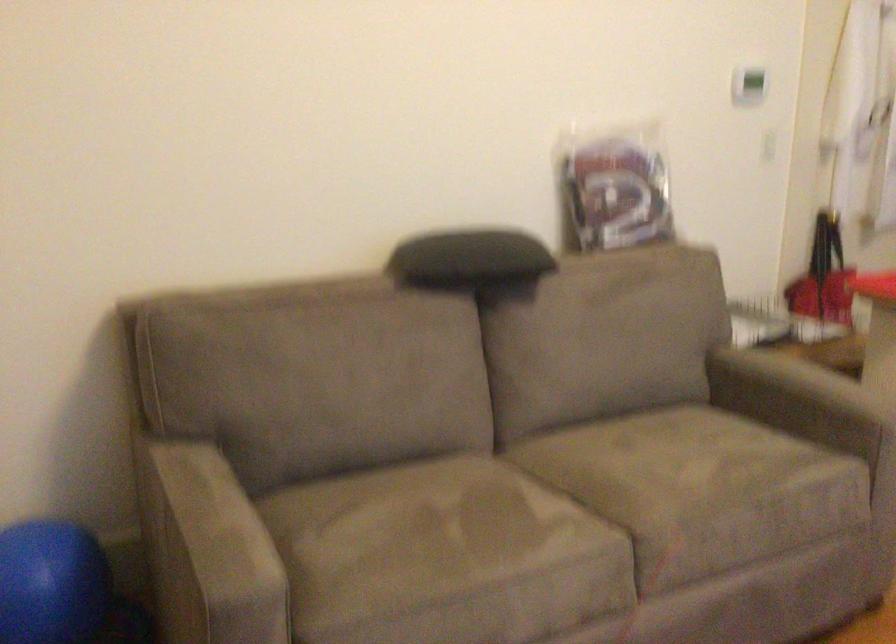
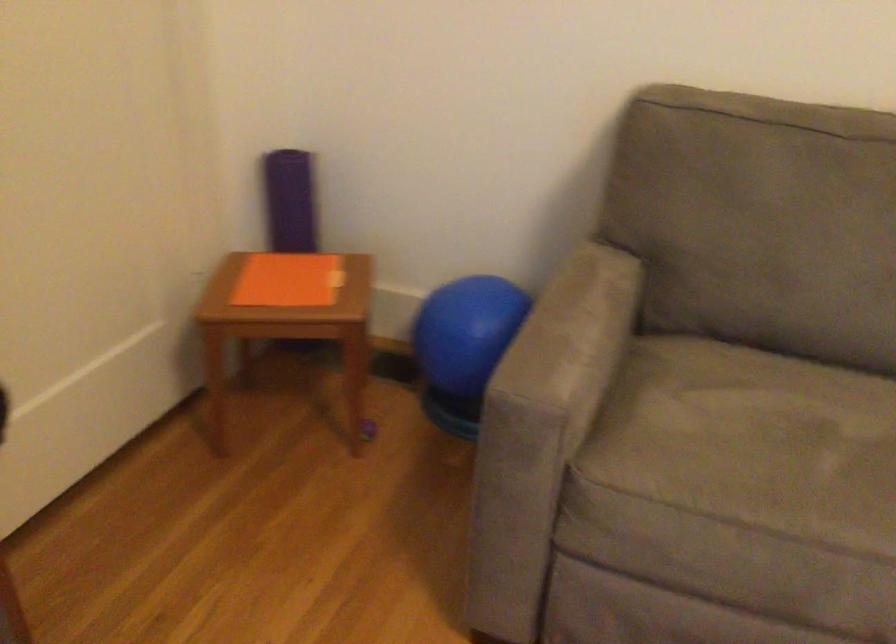
Locate, in the second image, the point that corresponds to pixel 398 544 in the first image.

(752, 442)